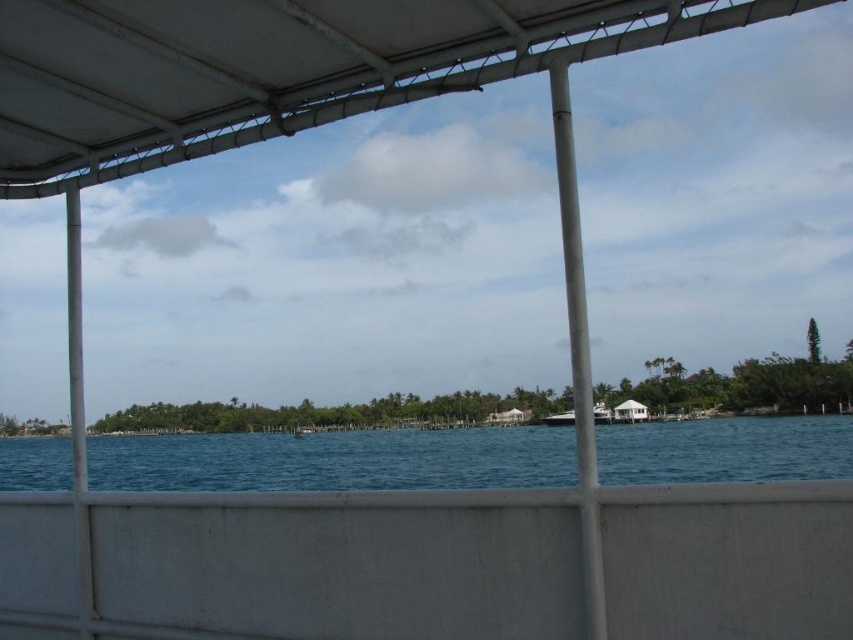
Question: Which object appears farthest from the camera in this image?

Choices:
 (A) white glossy boat at center
 (B) white matte canopy at upper center
 (C) blue water at center

Answer: (A)

Question: Estimate the real-world distances between objects in this image. Which object is farther from the white glossy boat at center?

Choices:
 (A) blue water at center
 (B) white matte canopy at upper center

Answer: (A)

Question: Is blue water at center to the right of white glossy boat at center from the viewer's perspective?

Choices:
 (A) no
 (B) yes

Answer: (A)

Question: Does white matte canopy at upper center have a lesser width compared to white glossy boat at center?

Choices:
 (A) no
 (B) yes

Answer: (B)

Question: Is blue water at center smaller than white glossy boat at center?

Choices:
 (A) yes
 (B) no

Answer: (B)

Question: Which object is farther from the camera taking this photo?

Choices:
 (A) blue water at center
 (B) white glossy boat at center
 (C) white matte canopy at upper center

Answer: (B)